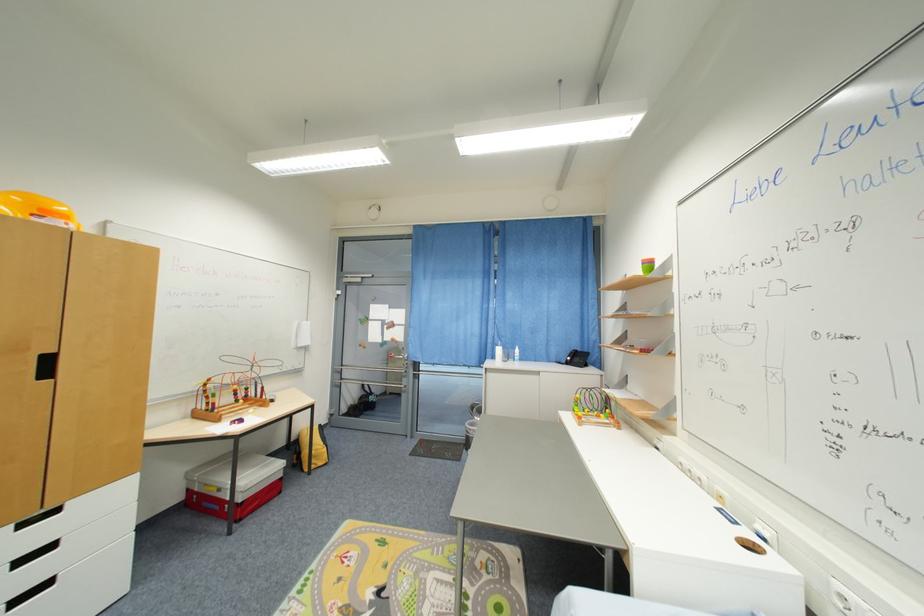
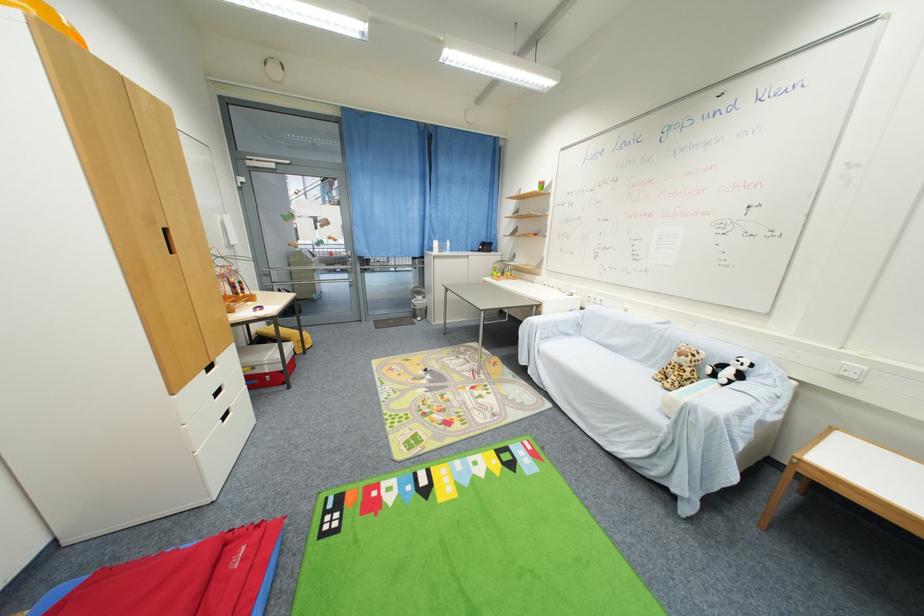
Find the pixel in the second image that matches point (642, 274) in the first image.

(541, 190)